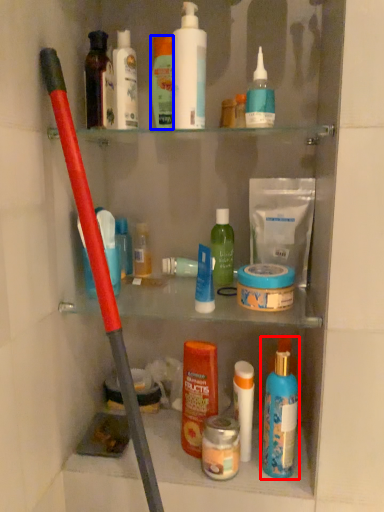
Question: Which of the following is the closest to the observer, toiletry (highlighted by a red box) or toiletry (highlighted by a blue box)?

Choices:
 (A) toiletry
 (B) toiletry

Answer: (A)